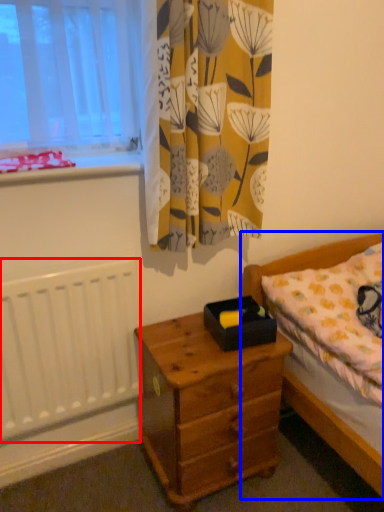
Question: Which object appears farthest to the camera in this image, radiator (highlighted by a red box) or bed (highlighted by a blue box)?

Choices:
 (A) radiator
 (B) bed

Answer: (A)